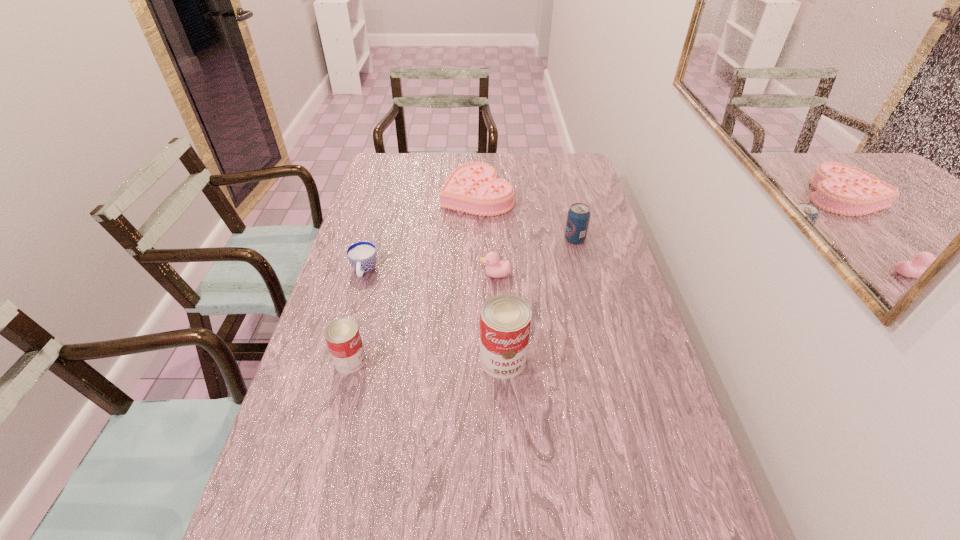
Find the location of a particular element. The image size is (960, 540). vacant space at the far edge of the desktop is located at coordinates (416, 156).

At what (x,y) coordinates should I click in order to perform the action: click on free space at the near edge of the desktop. Please return your answer as a coordinate pair (x, y). The image size is (960, 540). Looking at the image, I should click on (546, 515).

You are a GUI agent. You are given a task and a screenshot of the screen. Output one action in this format:
    pyautogui.click(x=<x>, y=<y>)
    Task: Click on the vacant space at the left edge
    Image resolution: width=960 pixels, height=540 pixels.
    Given the screenshot: What is the action you would take?
    pyautogui.click(x=369, y=224)

Where is `vacant area at the right edge of the desktop`? vacant area at the right edge of the desktop is located at coordinates (600, 270).

You are a GUI agent. You are given a task and a screenshot of the screen. Output one action in this format:
    pyautogui.click(x=<x>, y=<y>)
    Task: Click on the vacant area at the far left corner of the desktop
    The width and height of the screenshot is (960, 540).
    Given the screenshot: What is the action you would take?
    pyautogui.click(x=403, y=173)

Identify the location of free space at the far right corner of the desktop. (573, 171).

Locate an element on the screen. The image size is (960, 540). free space at the near right corner of the desktop is located at coordinates (698, 500).

This screenshot has height=540, width=960. In order to click on free space between the rightmost object and the left can in this screenshot , I will do `click(463, 300)`.

What are the coordinates of `vacant space in between the cake and the cup` in the screenshot? It's located at (420, 233).

The image size is (960, 540). Identify the location of vacant point located between the cake and the shorter can. (414, 278).